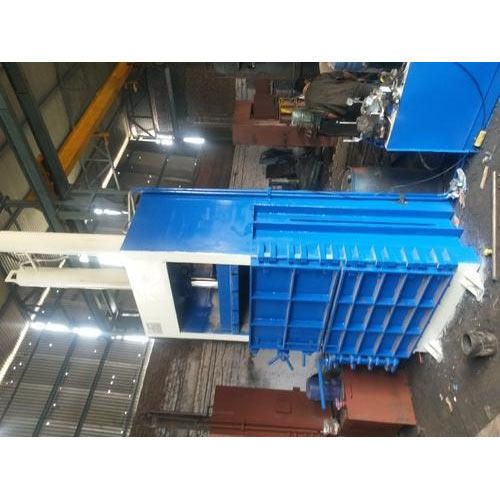
At what (x,y) coordinates should I click in order to perform the action: click on burgundy shelves. Please return your answer as a coordinate pair (x, y). This screenshot has width=500, height=500. Looking at the image, I should click on (251, 411), (269, 145).